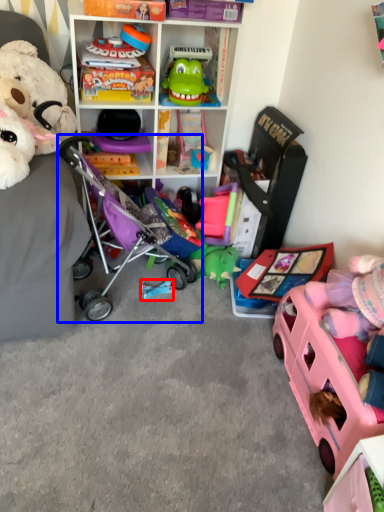
Question: Which object is closer to the camera taking this photo, toy (highlighted by a red box) or baby carriage (highlighted by a blue box)?

Choices:
 (A) toy
 (B) baby carriage

Answer: (B)